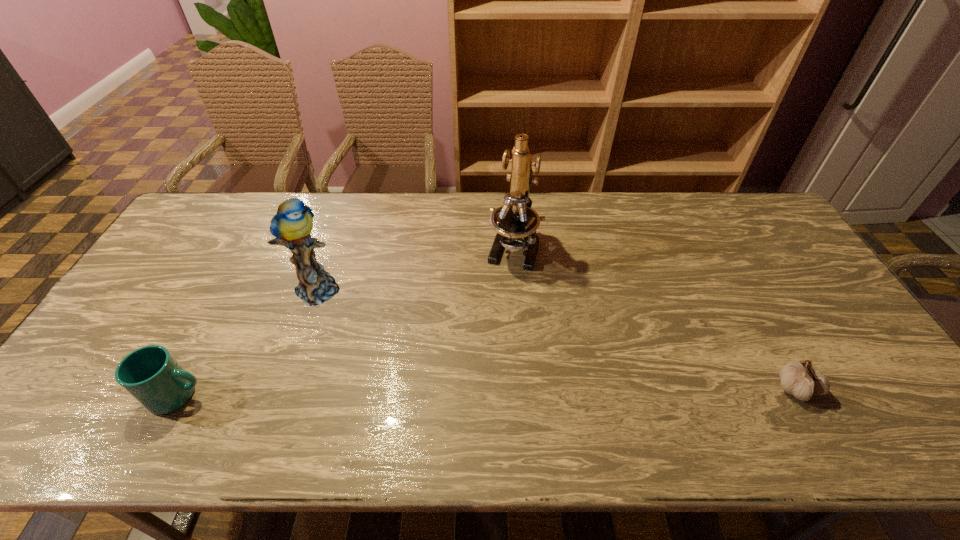
Locate an element on the screen. This screenshot has height=540, width=960. free spot between the leftmost object and the second tallest object is located at coordinates (250, 341).

Image resolution: width=960 pixels, height=540 pixels. I want to click on vacant point located between the third object from right to left and the garlic, so click(558, 337).

Locate an element on the screen. This screenshot has width=960, height=540. the third closest object to the cup is located at coordinates click(800, 379).

Locate which object ranks third in proximity to the garlic. Please provide its 2D coordinates. Your answer should be formatted as a tuple, i.e. [(x, y)], where the tuple contains the x and y coordinates of a point satisfying the conditions above.

[(151, 375)]

Locate an element on the screen. The width and height of the screenshot is (960, 540). blank space that satisfies the following two spatial constraints: 1. on the front side of the garlic; 2. on the right side of the third object from left to right is located at coordinates (524, 388).